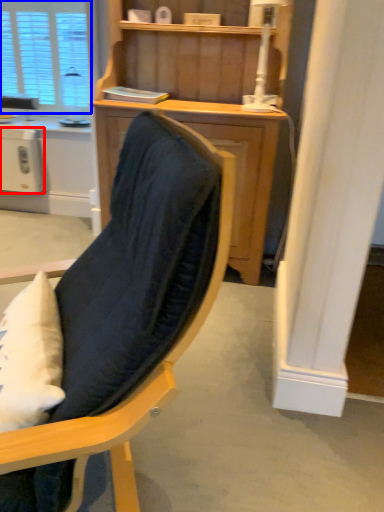
Question: Among these objects, which one is farthest to the camera, appliance (highlighted by a red box) or window (highlighted by a blue box)?

Choices:
 (A) appliance
 (B) window

Answer: (B)